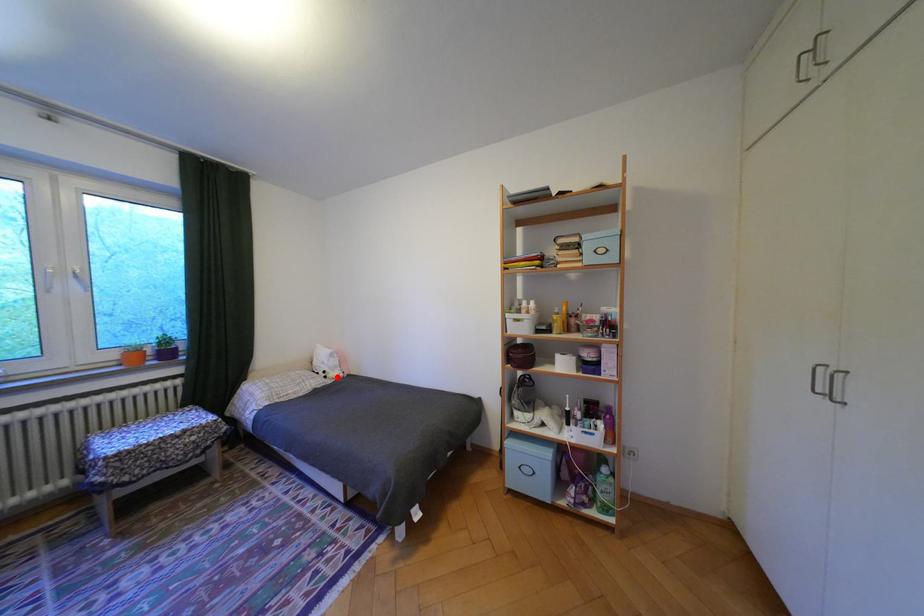
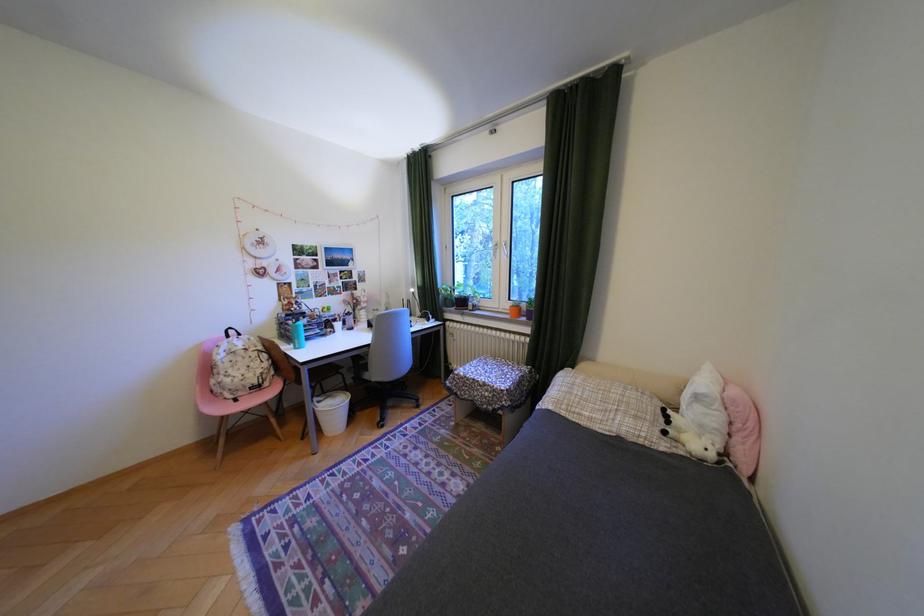
In the second image, find the point that corresponds to the highlighted location in the first image.

(676, 432)